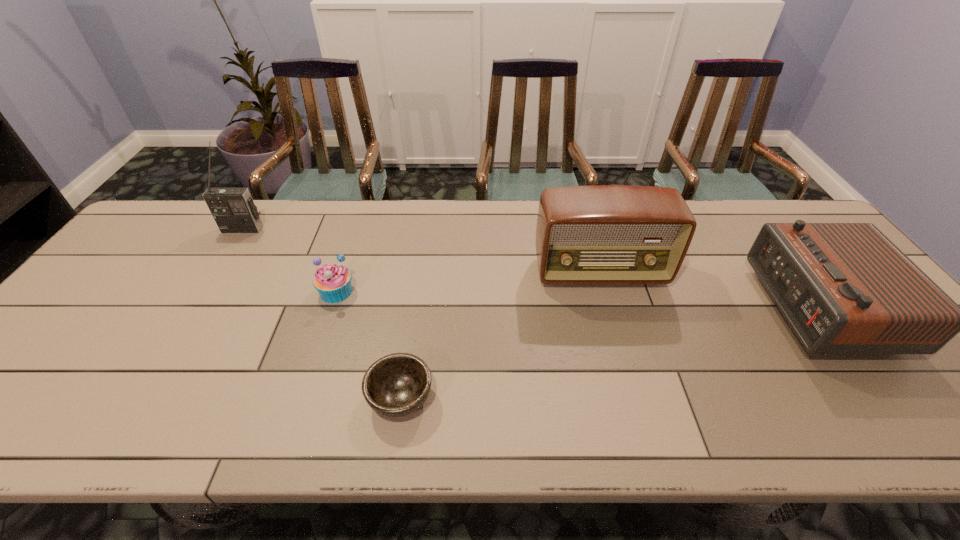
Image resolution: width=960 pixels, height=540 pixels. Find the location of `vacant space at the far edge of the desktop`. vacant space at the far edge of the desktop is located at coordinates (313, 205).

Image resolution: width=960 pixels, height=540 pixels. In the image, there is a desktop. In order to click on vacant area at the near edge in this screenshot , I will do `click(656, 423)`.

Where is `vacant space at the left edge`? The image size is (960, 540). vacant space at the left edge is located at coordinates (150, 275).

At what (x,y) coordinates should I click in order to perform the action: click on unoccupied position between the fourth object from right to left and the farthest object. Please return your answer as a coordinate pair (x, y). The height and width of the screenshot is (540, 960). Looking at the image, I should click on (290, 260).

Find the location of a particular element. The height and width of the screenshot is (540, 960). free spot between the leftmost object and the shortest radio receiver is located at coordinates (532, 268).

The image size is (960, 540). Find the location of `vacant space that is in between the rightmost radio receiver and the bowl`. vacant space that is in between the rightmost radio receiver and the bowl is located at coordinates (610, 353).

You are a GUI agent. You are given a task and a screenshot of the screen. Output one action in this format:
    pyautogui.click(x=<x>, y=<y>)
    Task: Click on the free space between the bowl and the second object from left to right
    The image size is (960, 540).
    Given the screenshot: What is the action you would take?
    pyautogui.click(x=369, y=345)

Locate an element on the screen. The width and height of the screenshot is (960, 540). free spot between the rightmost radio receiver and the farthest object is located at coordinates (532, 268).

The image size is (960, 540). Find the location of `empty space that is in between the third shortest object and the shortest object`. empty space that is in between the third shortest object and the shortest object is located at coordinates (610, 353).

Identify the location of vacant space in between the rightmost object and the second shortest radio receiver. (709, 290).